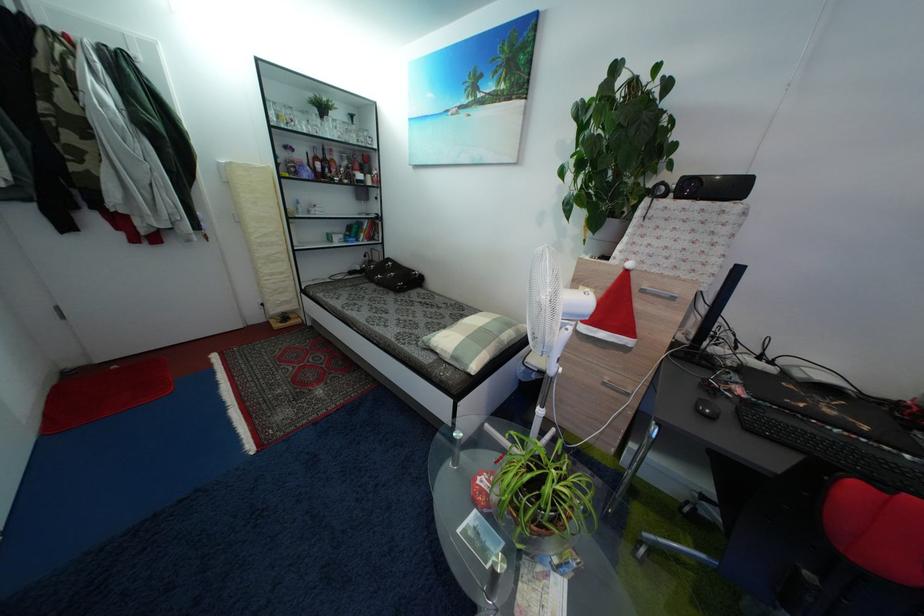
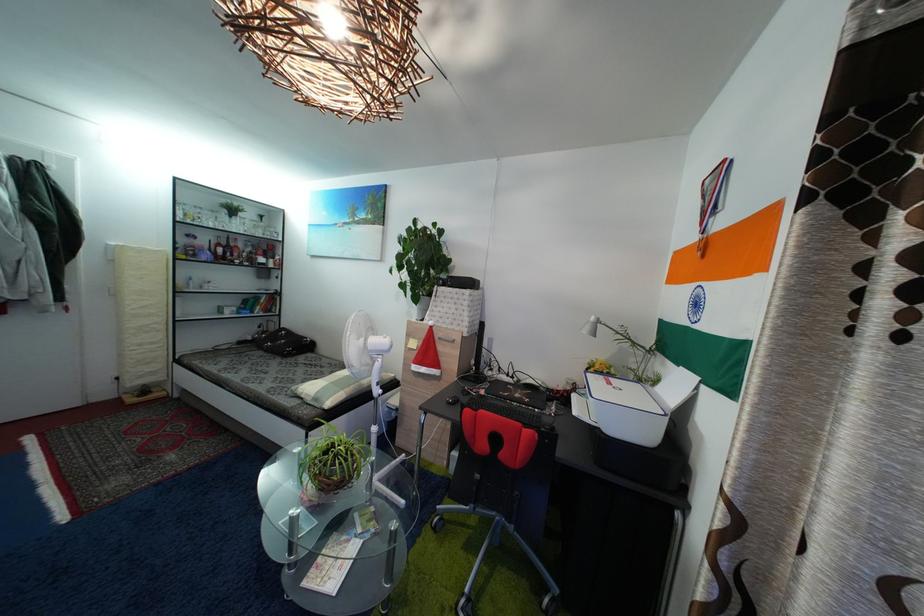
In the second image, find the point that corresponds to the point at 627,254 in the first image.

(435, 321)